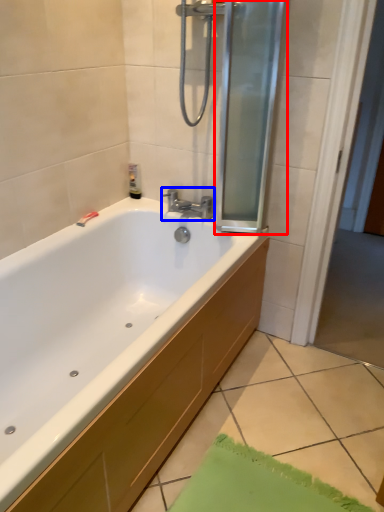
Question: Among these objects, which one is nearest to the camera, screen door (highlighted by a red box) or tap (highlighted by a blue box)?

Choices:
 (A) screen door
 (B) tap

Answer: (A)